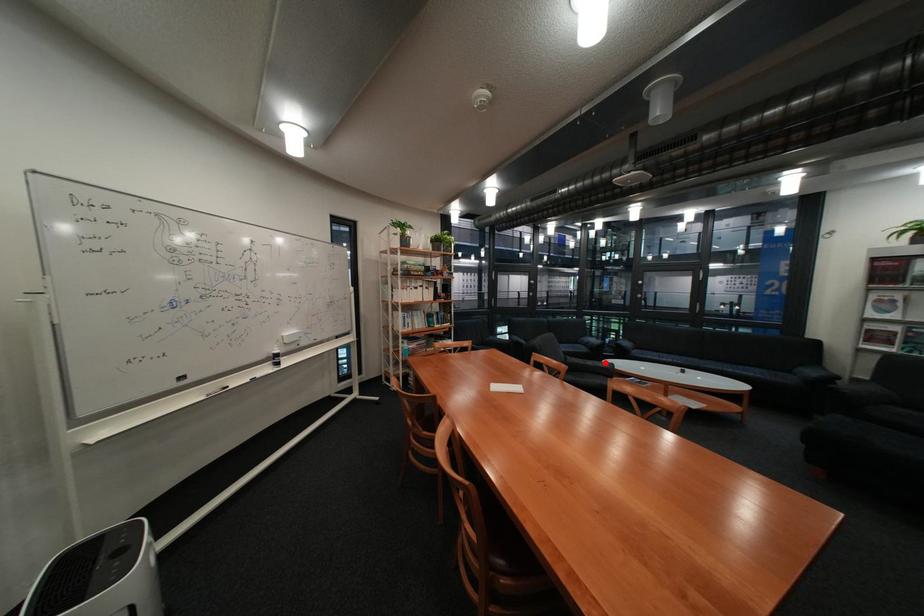
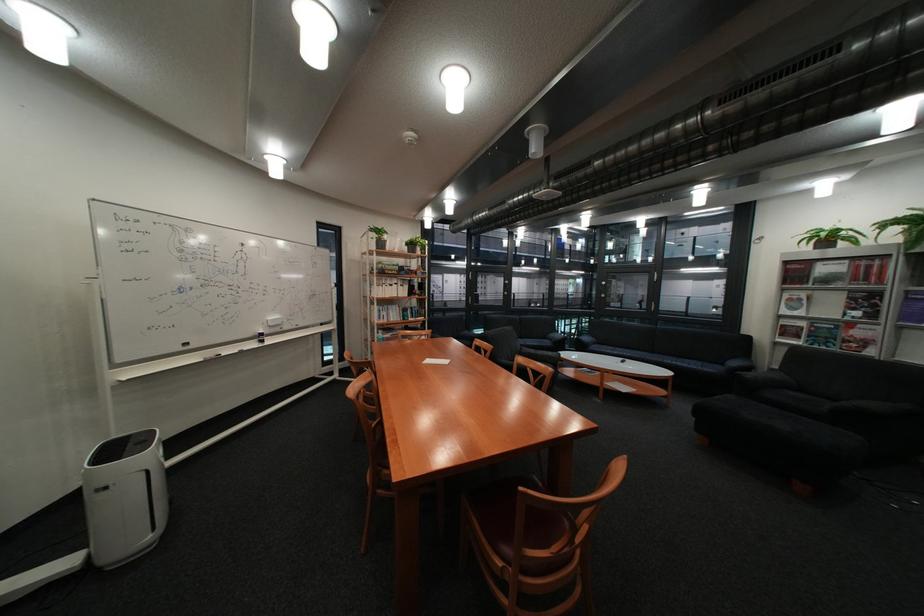
The point at the highlighted location is marked in the first image. Where is the corresponding point in the second image?

(555, 353)